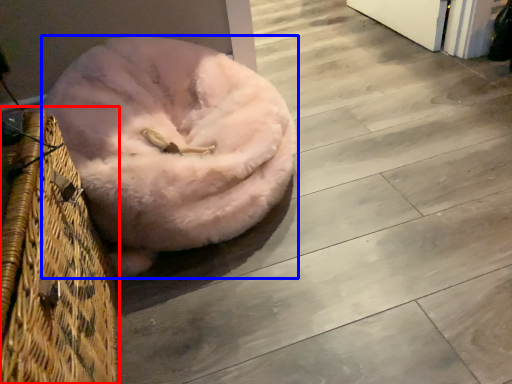
Question: Which point is further to the camera, basket (highlighted by a red box) or dog bed (highlighted by a blue box)?

Choices:
 (A) basket
 (B) dog bed

Answer: (B)